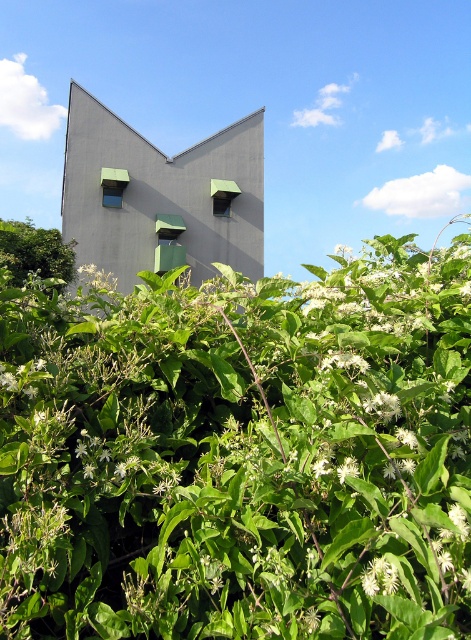
You are standing in front of the modern building and notice two points marked in the scene. The first point is at coordinates point (318, 289) and the second is at point (40, 253). Which of these two points is nearer to your current position?

Point (318, 289) is closer to the viewer than point (40, 253).